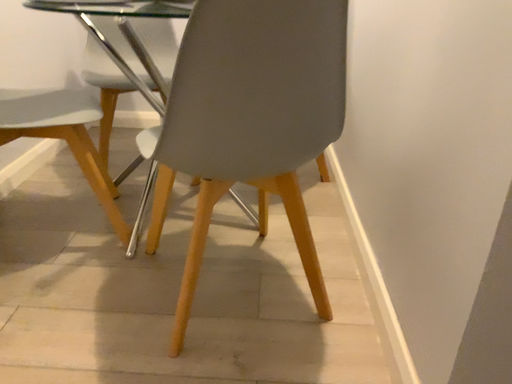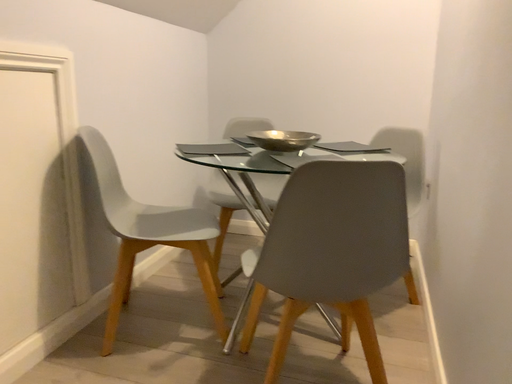
Question: How did the camera likely rotate when shooting the video?

Choices:
 (A) rotated upward
 (B) rotated downward

Answer: (A)